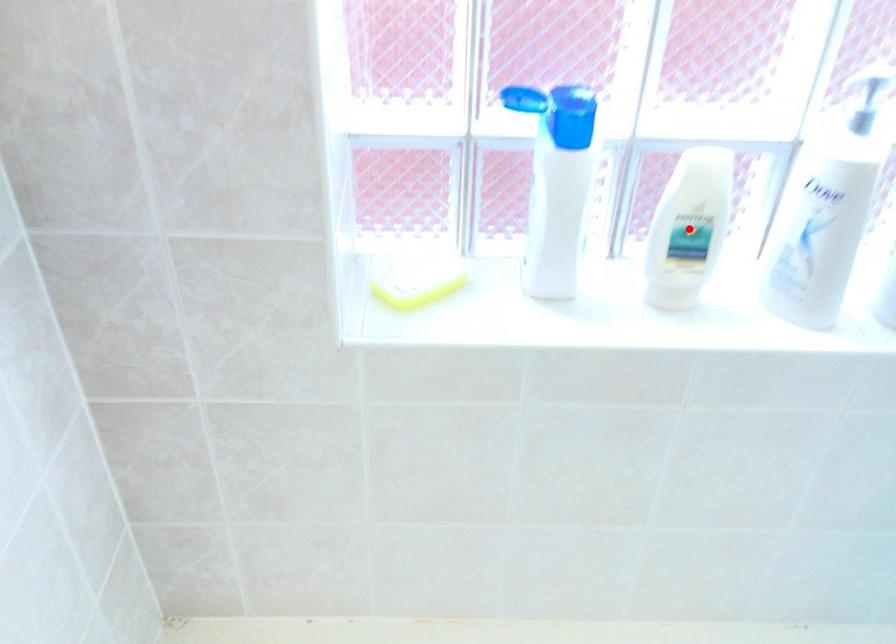
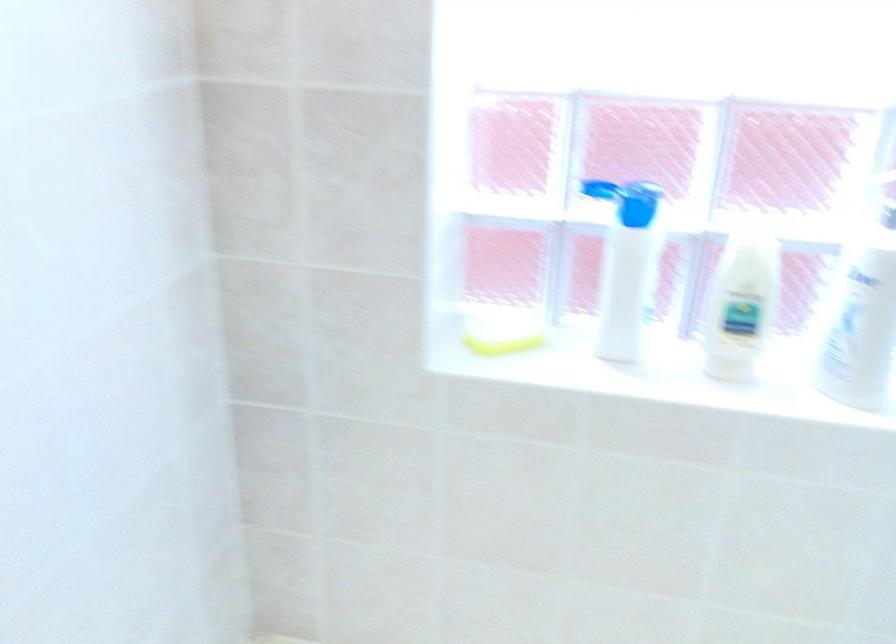
The point at the highlighted location is marked in the first image. Where is the corresponding point in the second image?

(741, 305)